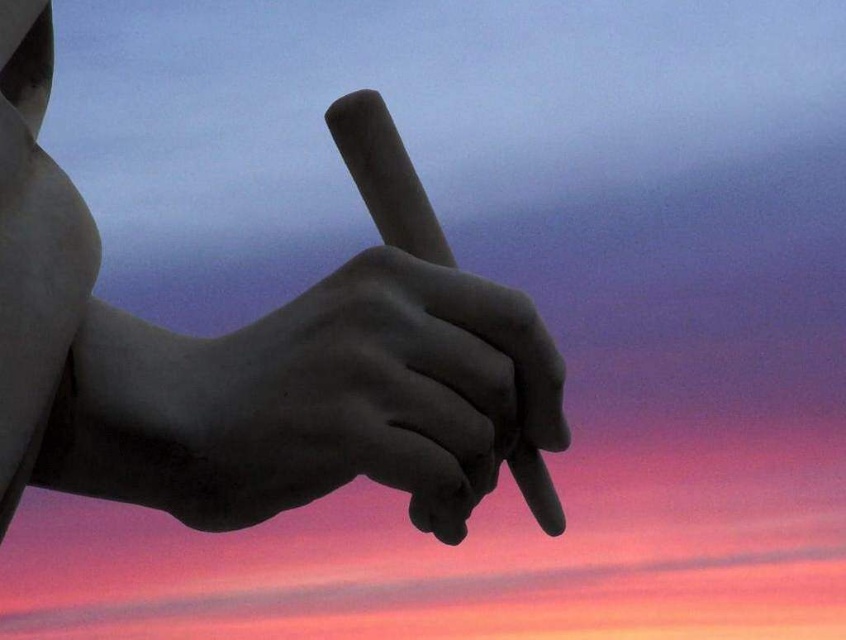
Question: Is matte gray pencil at center to the left of matte black hand at center from the viewer's perspective?

Choices:
 (A) yes
 (B) no

Answer: (A)

Question: Is matte gray pencil at center positioned at the back of matte black hand at center?

Choices:
 (A) no
 (B) yes

Answer: (A)

Question: Which point is closer to the camera?

Choices:
 (A) (509, 454)
 (B) (144, 428)

Answer: (A)

Question: Which point is closer to the camera taking this photo?

Choices:
 (A) (356, 145)
 (B) (224, 456)

Answer: (B)

Question: Does matte gray pencil at center come behind matte black hand at center?

Choices:
 (A) no
 (B) yes

Answer: (A)